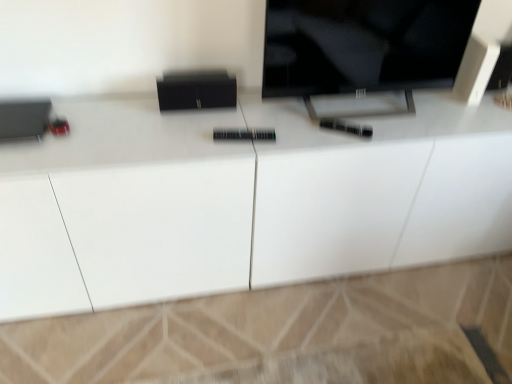
Question: Does white glossy cabinet at center appear on the right side of black glossy tv at upper center?

Choices:
 (A) no
 (B) yes

Answer: (A)

Question: Considering the relative sizes of white glossy cabinet at center and black glossy tv at upper center in the image provided, is white glossy cabinet at center taller than black glossy tv at upper center?

Choices:
 (A) yes
 (B) no

Answer: (A)

Question: Is white glossy cabinet at center next to black glossy tv at upper center and touching it?

Choices:
 (A) yes
 (B) no

Answer: (B)

Question: From a real-world perspective, is white glossy cabinet at center located higher than black glossy tv at upper center?

Choices:
 (A) yes
 (B) no

Answer: (B)

Question: From a real-world perspective, is white glossy cabinet at center physically below black glossy tv at upper center?

Choices:
 (A) no
 (B) yes

Answer: (B)

Question: Is white glossy cabinet at center far away from black glossy tv at upper center?

Choices:
 (A) no
 (B) yes

Answer: (A)

Question: From the image's perspective, is black glossy tv at upper center beneath white glossy cabinet at center?

Choices:
 (A) yes
 (B) no

Answer: (B)

Question: Is black glossy tv at upper center to the left of white glossy cabinet at center from the viewer's perspective?

Choices:
 (A) no
 (B) yes

Answer: (A)

Question: Are black glossy tv at upper center and white glossy cabinet at center far apart?

Choices:
 (A) no
 (B) yes

Answer: (A)

Question: Is black glossy tv at upper center facing towards white glossy cabinet at center?

Choices:
 (A) yes
 (B) no

Answer: (B)

Question: Can you confirm if black glossy tv at upper center is positioned to the right of white glossy cabinet at center?

Choices:
 (A) yes
 (B) no

Answer: (A)

Question: From a real-world perspective, is black glossy tv at upper center below white glossy cabinet at center?

Choices:
 (A) yes
 (B) no

Answer: (B)

Question: Is point (308, 56) closer or farther from the camera than point (480, 119)?

Choices:
 (A) closer
 (B) farther

Answer: (A)